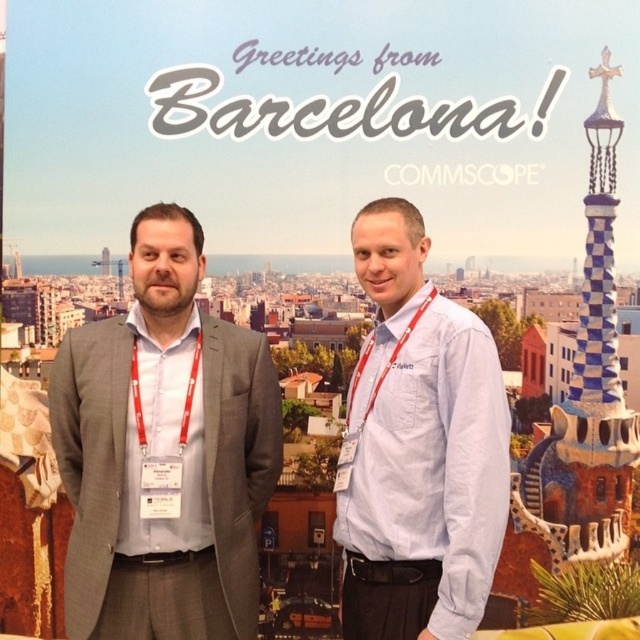
You are attending a conference in Barcelona and need to take a photo with the backdrop featuring the COMMSCOPE logo. You want to ensure that both the gray suit at left and the light blue shirt at center are clearly visible in the photo. Based on their positions, which person should you position closer to the camera to maintain their visibility without overlapping?

The gray suit at left is already closer to the viewer than the light blue shirt at center. To maintain visibility without overlapping, position the gray suit at left slightly closer to the camera and ensure the light blue shirt at center is a bit further back, aligning with their current spatial relationship.

You are at a conference in Barcelona and need to find the person in the light blue shirt at center. Which direction should you move from the gray suit at left to locate them?

The light blue shirt at center is to the right of the gray suit at left, so you should move to the right from the gray suit at left to locate them.